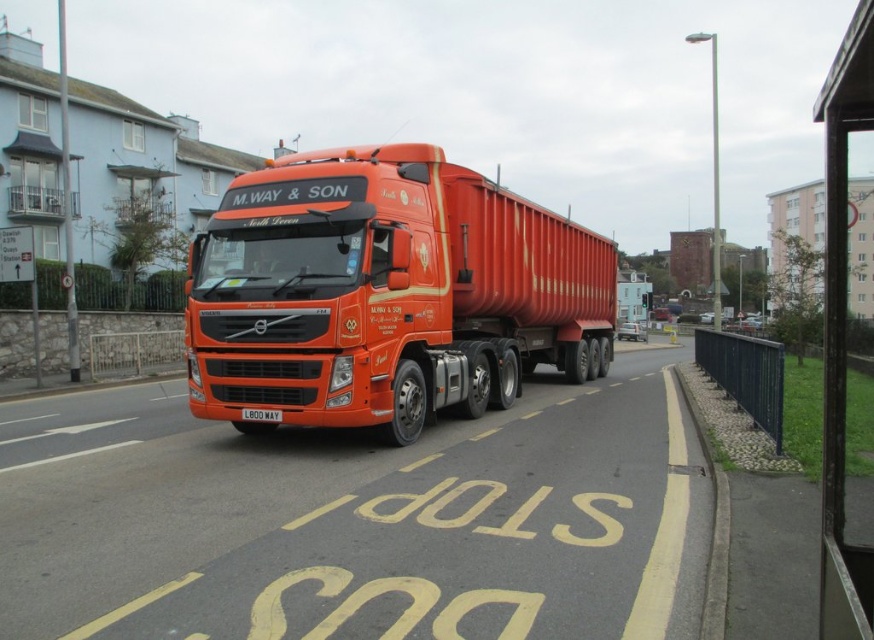
Between shiny orange trailer truck at center and white plastic license plate at center, which one is positioned lower?

Positioned lower is white plastic license plate at center.

At what (x,y) coordinates should I click in order to perform the action: click on shiny orange trailer truck at center. Please return your answer as a coordinate pair (x, y). Looking at the image, I should click on (386, 292).